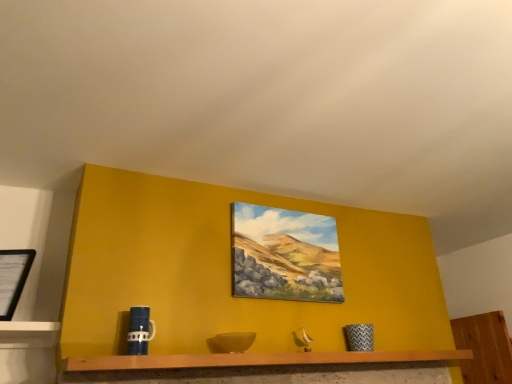
The height and width of the screenshot is (384, 512). Find the location of `vacant region below matte canvas painting at center, which ranks as the 1th picture frame in right-to-left order (from a real-world perspective)`. vacant region below matte canvas painting at center, which ranks as the 1th picture frame in right-to-left order (from a real-world perspective) is located at coordinates (290, 348).